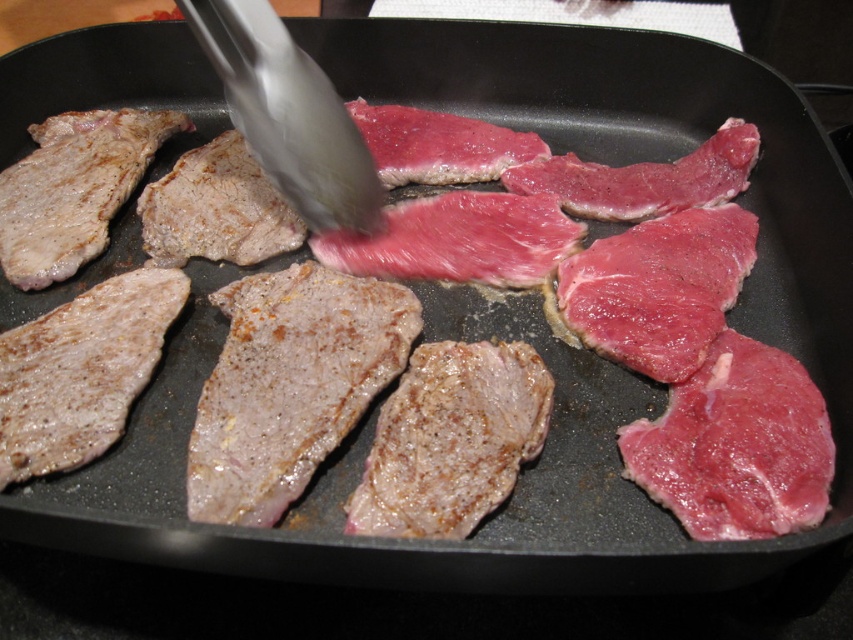
Who is lower down, pink raw meat at center or silver metallic tong at center?

Positioned lower is pink raw meat at center.

Is pink raw meat at center smaller than silver metallic tong at center?

Correct, pink raw meat at center occupies less space than silver metallic tong at center.

Is point (776, 465) positioned behind point (349, 180)?

That is False.

Find the location of a particular element. This screenshot has width=853, height=640. pink raw meat at center is located at coordinates click(x=735, y=445).